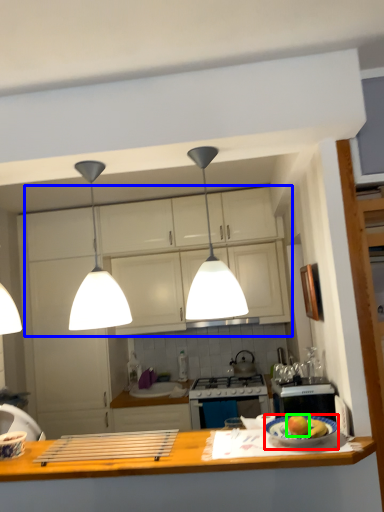
Question: Considering the real-world distances, which object is closest to plate (highlighted by a red box)? cabinetry (highlighted by a blue box) or apple (highlighted by a green box).

Choices:
 (A) cabinetry
 (B) apple

Answer: (B)